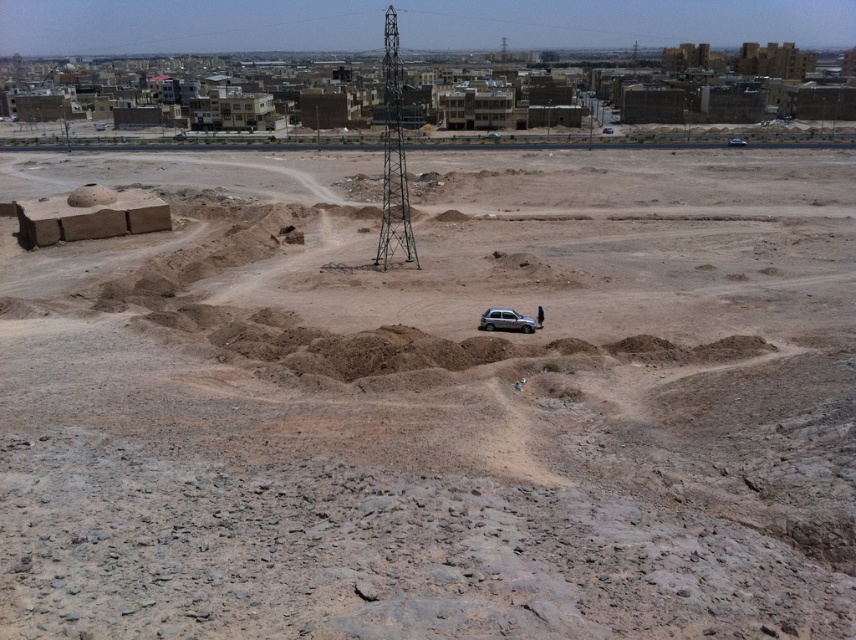
You are standing at the point marked at coordinates (393, 160) in the desert scene. What is the nearest object to you?

The nearest object to you is the metallic structure at center, as the point is located on it.

You are standing in the desert and see a point marked at coordinates (381, 260). If you need to reach a point that is exactly 50 meters away from your current position, would this point be within your reach?

The point at coordinates (381, 260) is 74.00 meters away from the viewer. Since 74 meters is greater than 50 meters, this point is beyond the 50 meters reach.

You are standing in the desert and see two points marked in the image. Which point is closer to you, point (393,211) or point (480,314)?

Point (393,211) is closer to you because it is further to the viewer than point (480,314).